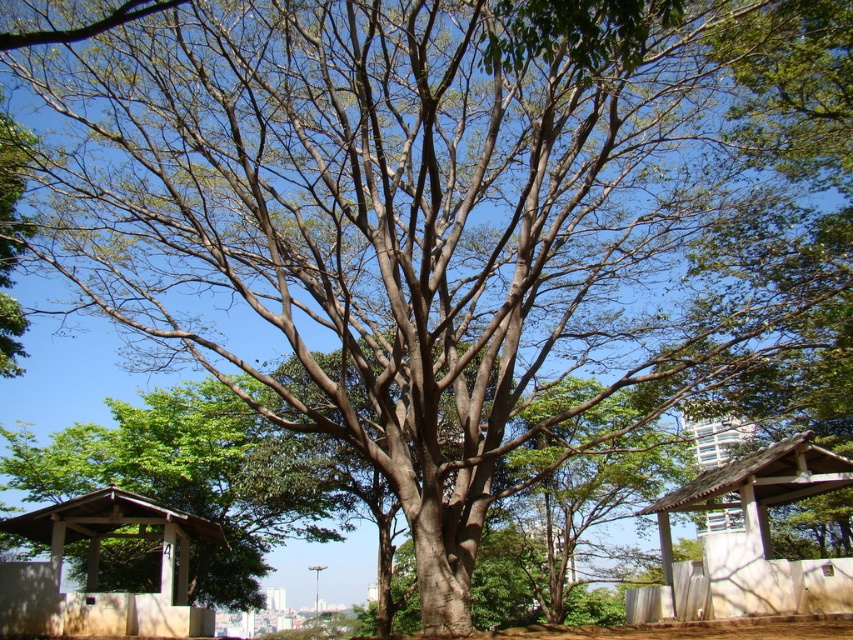
Is white wood gazebo at lower right in front of brown wood gazebo at lower left?

Yes, it is in front of brown wood gazebo at lower left.

Between white wood gazebo at lower right and brown wood gazebo at lower left, which one has less height?

brown wood gazebo at lower left

What do you see at coordinates (747, 541) in the screenshot? This screenshot has height=640, width=853. I see `white wood gazebo at lower right` at bounding box center [747, 541].

The height and width of the screenshot is (640, 853). In order to click on white wood gazebo at lower right in this screenshot , I will do `click(747, 541)`.